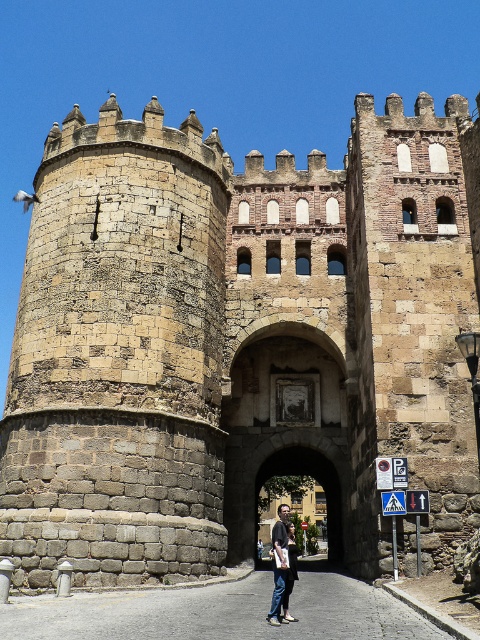
You are standing in front of the historic stone structure. There is a point marked at coordinates (x=316, y=480). What does this point represent?

The point at (x=316, y=480) represents the stone archway at center.

You are standing at the base of the historic stone structure and want to take a photo of the point at coordinates (294, 448). If your camera can focus on objects up to 200 feet away, will it be able to capture that point clearly?

The point at coordinates (294, 448) is 163.77 feet away from the camera, which is within the camera focus range of 200 feet. Therefore, the camera can capture the point clearly.